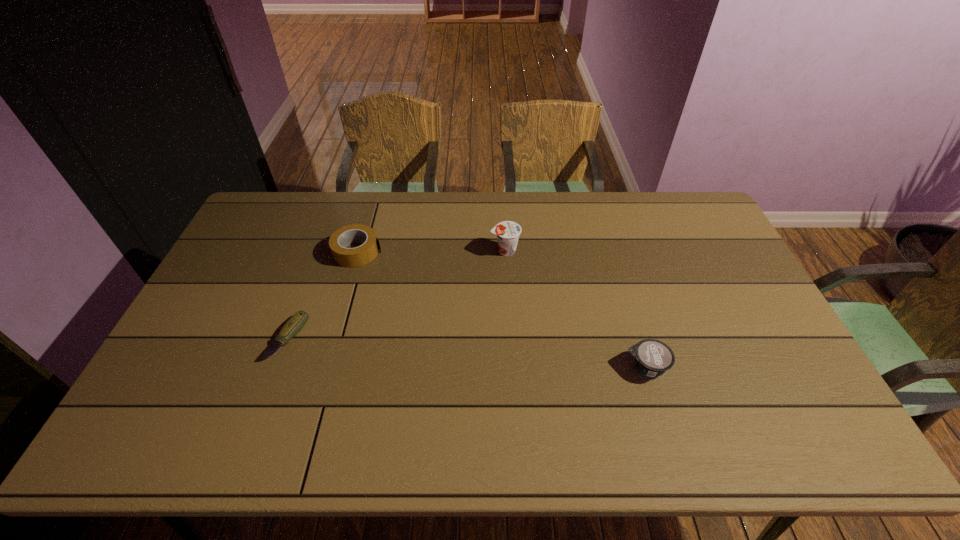
What are the coordinates of `the second object from right to left` in the screenshot? It's located at (507, 232).

This screenshot has height=540, width=960. I want to click on the farther yogurt, so click(507, 232).

I want to click on the second object from left to right, so click(359, 256).

Where is `the rightmost object`? The width and height of the screenshot is (960, 540). the rightmost object is located at coordinates (652, 357).

At what (x,y) coordinates should I click in order to perform the action: click on the shorter yogurt. Please return your answer as a coordinate pair (x, y). The width and height of the screenshot is (960, 540). Looking at the image, I should click on (652, 357).

I want to click on the leftmost object, so click(x=291, y=328).

Find the location of `pocketknife`. pocketknife is located at coordinates (291, 328).

The image size is (960, 540). I want to click on vacant space located 0.080m on the right of the left yogurt, so click(x=543, y=251).

Locate an element on the screen. vacant area situated at the edge of the duct tape is located at coordinates (480, 252).

Locate an element on the screen. free location located on the right of the nearer yogurt is located at coordinates (777, 367).